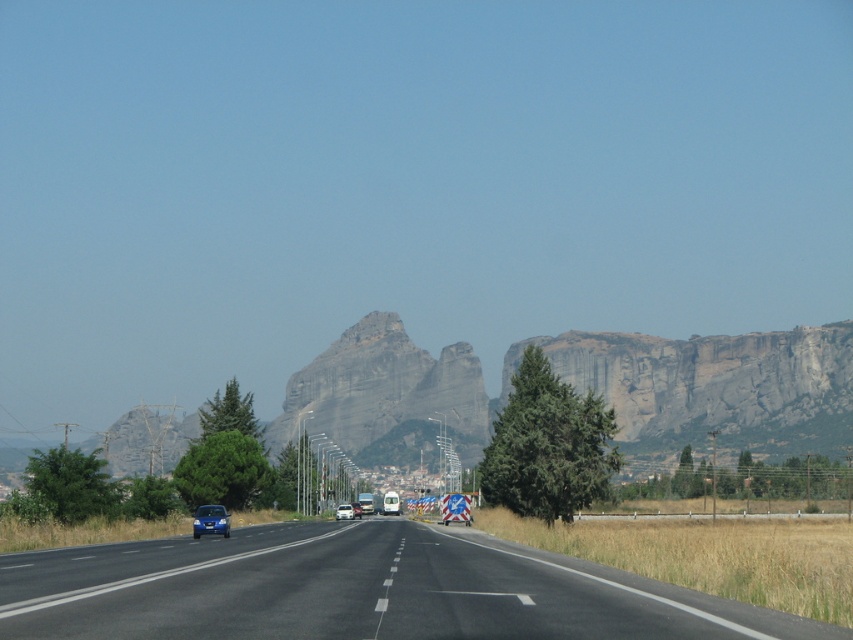
Who is positioned more to the left, blue matte car at center or blue metallic van at center?

Positioned to the left is blue matte car at center.

Is blue matte car at center to the left of blue metallic van at center from the viewer's perspective?

Indeed, blue matte car at center is positioned on the left side of blue metallic van at center.

Who is more distant from viewer, (347, 513) or (352, 502)?

The point (352, 502) is behind.

In order to click on blue matte car at center in this screenshot , I will do `click(344, 512)`.

Does point (576, 634) come farther from viewer compared to point (355, 508)?

No, (576, 634) is closer to viewer.

Does black asphalt highway at center have a larger size compared to blue metallic van at center?

Yes, black asphalt highway at center is bigger than blue metallic van at center.

The height and width of the screenshot is (640, 853). What do you see at coordinates (358, 589) in the screenshot?
I see `black asphalt highway at center` at bounding box center [358, 589].

Find the location of a particular element. This screenshot has height=640, width=853. black asphalt highway at center is located at coordinates (358, 589).

Describe the element at coordinates (210, 520) in the screenshot. The image size is (853, 640). I see `metallic blue car at lower left` at that location.

This screenshot has height=640, width=853. In order to click on metallic blue car at lower left in this screenshot , I will do `click(210, 520)`.

Where is `metallic blue car at lower left`? The width and height of the screenshot is (853, 640). metallic blue car at lower left is located at coordinates (210, 520).